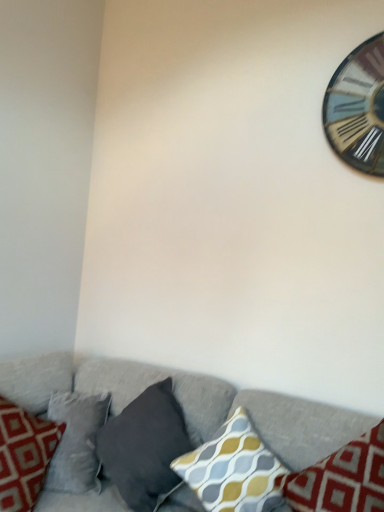
This screenshot has height=512, width=384. Describe the element at coordinates (145, 447) in the screenshot. I see `dark gray fabric pillow at lower center, which ranks as the 3th pillow in right-to-left order` at that location.

What is the approximate width of wooden clock at upper right?

2.33 centimeters.

In order to face yellow-gray patterned cushion at center, arranged as the second pillow when viewed from the left, should I rotate leftwards or rightwards?

It's best to rotate right around 4.962 degrees.

I want to click on dark gray fabric pillow at lower center, arranged as the 1th pillow when viewed from the left, so click(145, 447).

Between point (357, 111) and point (78, 501), which one is positioned in front?

The point (78, 501) is closer.

Who is more distant, wooden clock at upper right or textured gray couch at lower center?

wooden clock at upper right is further from the camera.

Can you tell me how much wooden clock at upper right and textured gray couch at lower center differ in facing direction?

The angular difference between wooden clock at upper right and textured gray couch at lower center is 0.144 degrees.

Locate an element on the screen. studio couch below the wooden clock at upper right (from a real-world perspective) is located at coordinates (189, 402).

Considering the relative sizes of yellow-gray patterned pillow at lower right, which is the third pillow in left-to-right order, and dark gray fabric pillow at lower center, arranged as the 1th pillow when viewed from the left, in the image provided, is yellow-gray patterned pillow at lower right, which is the third pillow in left-to-right order, taller than dark gray fabric pillow at lower center, arranged as the 1th pillow when viewed from the left,?

Yes.

Is yellow-gray patterned pillow at lower right, which is the first pillow from right to left, facing towards dark gray fabric pillow at lower center, which ranks as the 3th pillow in right-to-left order?

No, yellow-gray patterned pillow at lower right, which is the first pillow from right to left, is not aimed at dark gray fabric pillow at lower center, which ranks as the 3th pillow in right-to-left order.

Which pillow is the 2nd one when counting from the front of the dark gray fabric pillow at lower center, which ranks as the 3th pillow in right-to-left order? Please provide its 2D coordinates.

[(341, 478)]

From a real-world perspective, who is located lower, yellow-gray patterned pillow at lower right, which is the third pillow in left-to-right order, or dark gray fabric pillow at lower center, arranged as the 1th pillow when viewed from the left?

dark gray fabric pillow at lower center, arranged as the 1th pillow when viewed from the left, is physically lower.

In terms of width, does dark gray fabric pillow at lower center, arranged as the 1th pillow when viewed from the left, look wider or thinner when compared to textured gray couch at lower center?

dark gray fabric pillow at lower center, arranged as the 1th pillow when viewed from the left, is thinner than textured gray couch at lower center.

Locate an element on the screen. studio couch below the dark gray fabric pillow at lower center, arranged as the 1th pillow when viewed from the left (from the image's perspective) is located at coordinates (189, 402).

From the picture: How much distance is there between yellow-gray patterned cushion at center, arranged as the second pillow when viewed from the left, and dark gray fabric pillow at lower center, which ranks as the 3th pillow in right-to-left order?

yellow-gray patterned cushion at center, arranged as the second pillow when viewed from the left, and dark gray fabric pillow at lower center, which ranks as the 3th pillow in right-to-left order, are 7.71 inches apart from each other.

Consider the image. Is yellow-gray patterned cushion at center, arranged as the second pillow when viewed from the left, positioned with its back to dark gray fabric pillow at lower center, which ranks as the 3th pillow in right-to-left order?

No, dark gray fabric pillow at lower center, which ranks as the 3th pillow in right-to-left order, is not at the back of yellow-gray patterned cushion at center, arranged as the second pillow when viewed from the left.

Does yellow-gray patterned cushion at center, arranged as the second pillow when viewed from the left, come in front of dark gray fabric pillow at lower center, which ranks as the 3th pillow in right-to-left order?

Yes, yellow-gray patterned cushion at center, arranged as the second pillow when viewed from the left, is in front of dark gray fabric pillow at lower center, which ranks as the 3th pillow in right-to-left order.

Between point (260, 496) and point (188, 444), which one is positioned behind?

The point (188, 444) is farther.

From a real-world perspective, which is physically below, yellow-gray patterned pillow at lower right, which is the first pillow from right to left, or textured gray couch at lower center?

From a 3D spatial view, textured gray couch at lower center is below.

Would you say yellow-gray patterned pillow at lower right, which is the third pillow in left-to-right order, is to the left or to the right of textured gray couch at lower center in the picture?

In the image, yellow-gray patterned pillow at lower right, which is the third pillow in left-to-right order, appears on the right side of textured gray couch at lower center.

Is yellow-gray patterned pillow at lower right, which is the first pillow from right to left, closer to camera compared to textured gray couch at lower center?

No, yellow-gray patterned pillow at lower right, which is the first pillow from right to left, is further to the viewer.

Is point (369, 470) closer to viewer compared to point (27, 390)?

That is True.

Is yellow-gray patterned cushion at center, the second pillow from the right, at the back of wooden clock at upper right?

wooden clock at upper right does not have its back to yellow-gray patterned cushion at center, the second pillow from the right.

Would you consider wooden clock at upper right to be distant from yellow-gray patterned cushion at center, arranged as the second pillow when viewed from the left?

Indeed, wooden clock at upper right is not near yellow-gray patterned cushion at center, arranged as the second pillow when viewed from the left.

Looking at this image, is wooden clock at upper right outside of yellow-gray patterned cushion at center, arranged as the second pillow when viewed from the left?

Yes.

Is wooden clock at upper right smaller than yellow-gray patterned cushion at center, arranged as the second pillow when viewed from the left?

Yes, wooden clock at upper right is smaller than yellow-gray patterned cushion at center, arranged as the second pillow when viewed from the left.

Does textured gray couch at lower center have a greater width compared to dark gray fabric pillow at lower center, which ranks as the 3th pillow in right-to-left order?

Yes, textured gray couch at lower center is wider than dark gray fabric pillow at lower center, which ranks as the 3th pillow in right-to-left order.

Is dark gray fabric pillow at lower center, arranged as the 1th pillow when viewed from the left, a part of textured gray couch at lower center?

Yes, textured gray couch at lower center contains dark gray fabric pillow at lower center, arranged as the 1th pillow when viewed from the left.

Which of these two, textured gray couch at lower center or dark gray fabric pillow at lower center, which ranks as the 3th pillow in right-to-left order, is smaller?

dark gray fabric pillow at lower center, which ranks as the 3th pillow in right-to-left order.

Considering the relative sizes of textured gray couch at lower center and dark gray fabric pillow at lower center, which ranks as the 3th pillow in right-to-left order, in the image provided, is textured gray couch at lower center taller than dark gray fabric pillow at lower center, which ranks as the 3th pillow in right-to-left order,?

Indeed, textured gray couch at lower center has a greater height compared to dark gray fabric pillow at lower center, which ranks as the 3th pillow in right-to-left order.

You are a GUI agent. You are given a task and a screenshot of the screen. Output one action in this format:
    pyautogui.click(x=<x>, y=<y>)
    Task: Click on the wall clock above the textured gray couch at lower center (from the image's perspective)
    
    Given the screenshot: What is the action you would take?
    pyautogui.click(x=358, y=108)

Which pillow is the 2nd one when counting from the back of the yellow-gray patterned pillow at lower right, which is the third pillow in left-to-right order? Please provide its 2D coordinates.

[(145, 447)]

Which object lies further to the anchor point yellow-gray patterned pillow at lower right, which is the first pillow from right to left, yellow-gray patterned cushion at center, the second pillow from the right, or textured gray couch at lower center?

Among the two, textured gray couch at lower center is located further to yellow-gray patterned pillow at lower right, which is the first pillow from right to left.

From the picture: Looking at the image, which one is located closer to dark gray fabric pillow at lower center, arranged as the 1th pillow when viewed from the left, yellow-gray patterned pillow at lower right, which is the first pillow from right to left, or wooden clock at upper right?

Among the two, yellow-gray patterned pillow at lower right, which is the first pillow from right to left, is located nearer to dark gray fabric pillow at lower center, arranged as the 1th pillow when viewed from the left.

Which object lies nearer to the anchor point wooden clock at upper right, textured gray couch at lower center or yellow-gray patterned pillow at lower right, which is the first pillow from right to left?

yellow-gray patterned pillow at lower right, which is the first pillow from right to left.

Considering their positions, is yellow-gray patterned pillow at lower right, which is the third pillow in left-to-right order, positioned closer to yellow-gray patterned cushion at center, the second pillow from the right, than textured gray couch at lower center?

yellow-gray patterned pillow at lower right, which is the third pillow in left-to-right order, is closer to yellow-gray patterned cushion at center, the second pillow from the right.

When comparing their distances from wooden clock at upper right, does dark gray fabric pillow at lower center, which ranks as the 3th pillow in right-to-left order, or textured gray couch at lower center seem further?

The object further to wooden clock at upper right is dark gray fabric pillow at lower center, which ranks as the 3th pillow in right-to-left order.

From the image, which object appears to be nearer to yellow-gray patterned pillow at lower right, which is the first pillow from right to left, textured gray couch at lower center or dark gray fabric pillow at lower center, which ranks as the 3th pillow in right-to-left order?

Among the two, textured gray couch at lower center is located nearer to yellow-gray patterned pillow at lower right, which is the first pillow from right to left.

From the image, which object appears to be farther from textured gray couch at lower center, dark gray fabric pillow at lower center, arranged as the 1th pillow when viewed from the left, or yellow-gray patterned pillow at lower right, which is the third pillow in left-to-right order?

Among the two, yellow-gray patterned pillow at lower right, which is the third pillow in left-to-right order, is located further to textured gray couch at lower center.

When comparing their distances from yellow-gray patterned cushion at center, arranged as the second pillow when viewed from the left, does dark gray fabric pillow at lower center, which ranks as the 3th pillow in right-to-left order, or yellow-gray patterned pillow at lower right, which is the first pillow from right to left, seem closer?

yellow-gray patterned pillow at lower right, which is the first pillow from right to left, is closer to yellow-gray patterned cushion at center, arranged as the second pillow when viewed from the left.

Where is `pillow between wooden clock at upper right and yellow-gray patterned pillow at lower right, which is the third pillow in left-to-right order, from top to bottom`? Image resolution: width=384 pixels, height=512 pixels. pillow between wooden clock at upper right and yellow-gray patterned pillow at lower right, which is the third pillow in left-to-right order, from top to bottom is located at coordinates (145, 447).

Image resolution: width=384 pixels, height=512 pixels. I want to click on pillow between textured gray couch at lower center and yellow-gray patterned cushion at center, arranged as the second pillow when viewed from the left, along the z-axis, so click(341, 478).

The image size is (384, 512). What are the coordinates of `pillow between dark gray fabric pillow at lower center, which ranks as the 3th pillow in right-to-left order, and yellow-gray patterned pillow at lower right, which is the first pillow from right to left` in the screenshot? It's located at (234, 469).